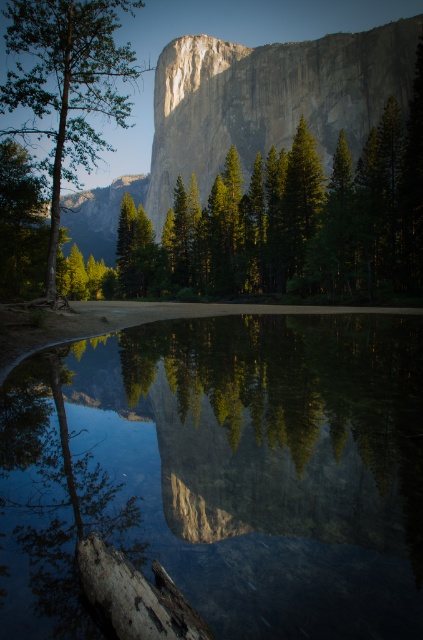
Question: Which point is closer to the camera taking this photo?

Choices:
 (A) (107, 602)
 (B) (244, 179)
 (C) (10, 80)

Answer: (A)

Question: Which of these objects is positioned farthest from the dark brown wood log at lower left?

Choices:
 (A) granite cliff at center
 (B) green matte tree at left

Answer: (A)

Question: Which object is closer to the camera taking this photo?

Choices:
 (A) granite cliff at center
 (B) dark brown wood log at lower left
 (C) transparent glass water at center
 (D) green matte tree at left

Answer: (B)

Question: Can you confirm if green matte tree at left is positioned to the right of dark brown wood log at lower left?

Choices:
 (A) no
 (B) yes

Answer: (A)

Question: Is green matte tree at left to the right of dark brown wood log at lower left from the viewer's perspective?

Choices:
 (A) no
 (B) yes

Answer: (A)

Question: Is transparent glass water at center further to the viewer compared to granite cliff at center?

Choices:
 (A) yes
 (B) no

Answer: (B)